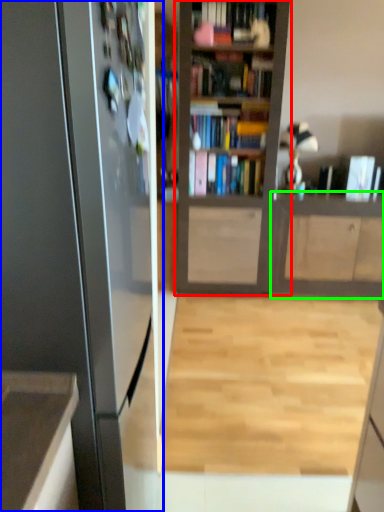
Question: Which object is the farthest from bookcase (highlighted by a red box)? Choose among these: appliance (highlighted by a blue box) or cabinetry (highlighted by a green box).

Choices:
 (A) appliance
 (B) cabinetry

Answer: (A)